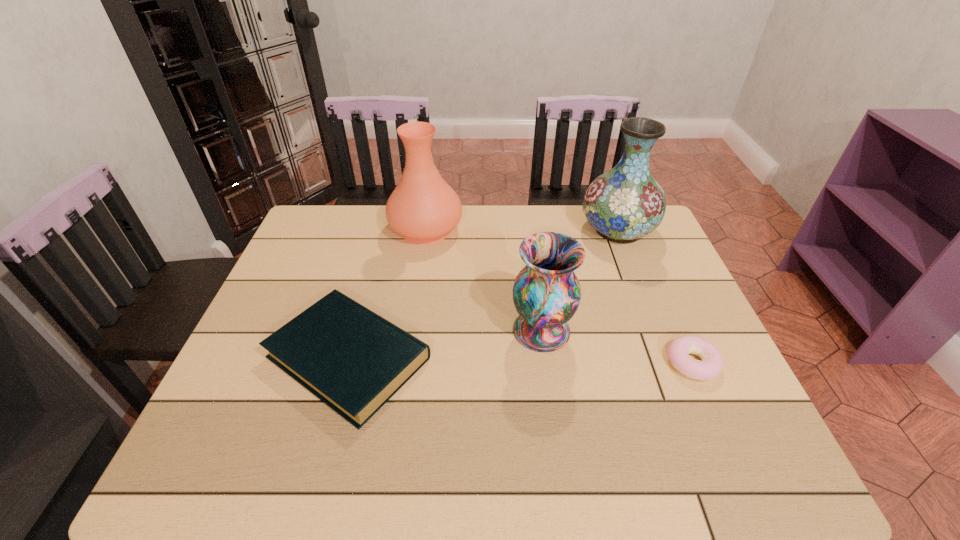
Identify which object is the third closest to the leftmost vase. Please provide its 2D coordinates. Your answer should be formatted as a tuple, i.e. [(x, y)], where the tuple contains the x and y coordinates of a point satisfying the conditions above.

[(626, 203)]

Identify which vase is the second nearest to the book. Please provide its 2D coordinates. Your answer should be formatted as a tuple, i.e. [(x, y)], where the tuple contains the x and y coordinates of a point satisfying the conditions above.

[(423, 208)]

Select which vase is the closest to the rightmost vase. Please provide its 2D coordinates. Your answer should be formatted as a tuple, i.e. [(x, y)], where the tuple contains the x and y coordinates of a point satisfying the conditions above.

[(546, 293)]

The image size is (960, 540). I want to click on free location that satisfies the following two spatial constraints: 1. on the back side of the rightmost vase; 2. on the left side of the third object from right to left, so click(x=528, y=230).